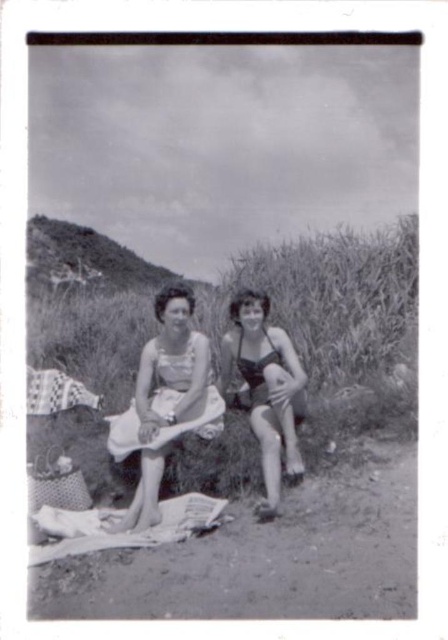
You are standing in the scene and want to walk from the point closer to you to the point further away. Which path should you take between the two points, point (94, 269) and point (223, 406)?

You should walk from point (94, 269) to point (223, 406) because point (94, 269) is closer to you and point (223, 406) is further away.

You are planning to take a photo of the matte black swimsuit at center and the grassy hillside at upper left. Which object is positioned lower in the image?

The matte black swimsuit at center is positioned lower than the grassy hillside at upper left.